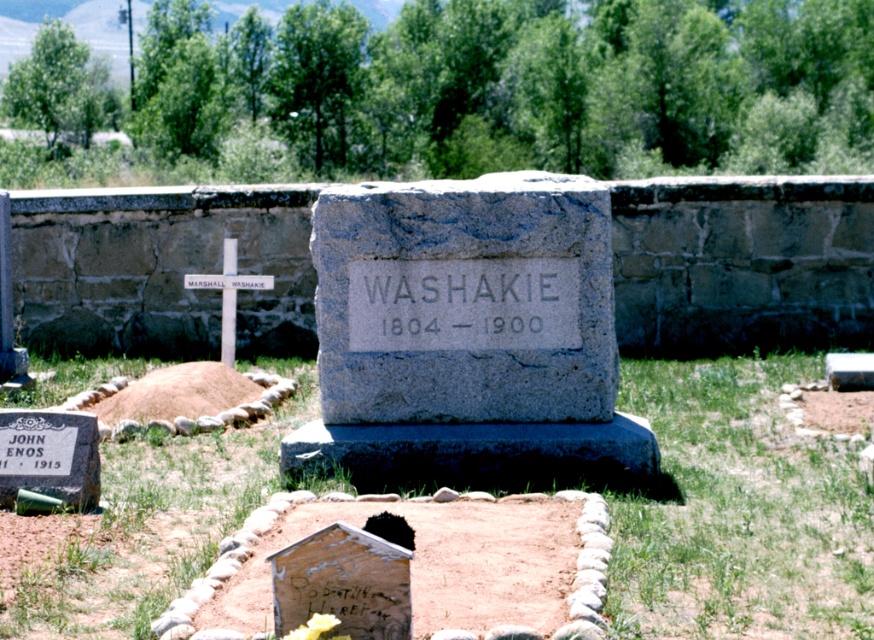
Does gray stone monument at center have a lesser height compared to white wood cross at center?

No.

Based on the photo, is gray stone monument at center to the left of white wood cross at center from the viewer's perspective?

No, gray stone monument at center is not to the left of white wood cross at center.

Who is more distant from viewer, (517, 237) or (200, 275)?

Positioned behind is point (200, 275).

Locate an element on the screen. This screenshot has height=640, width=874. gray stone monument at center is located at coordinates (467, 337).